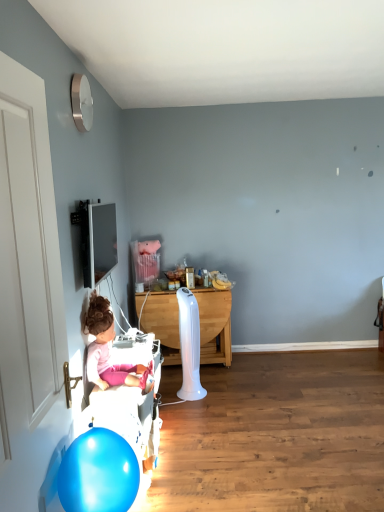
Question: Would you say pink fabric doll at lower left is outside blue glossy balloon at lower left?

Choices:
 (A) no
 (B) yes

Answer: (B)

Question: Can you confirm if pink fabric doll at lower left is thinner than blue glossy balloon at lower left?

Choices:
 (A) no
 (B) yes

Answer: (A)

Question: Does pink fabric doll at lower left have a greater height compared to blue glossy balloon at lower left?

Choices:
 (A) no
 (B) yes

Answer: (B)

Question: Considering the relative sizes of pink fabric doll at lower left and blue glossy balloon at lower left in the image provided, is pink fabric doll at lower left smaller than blue glossy balloon at lower left?

Choices:
 (A) no
 (B) yes

Answer: (A)

Question: From the image's perspective, is pink fabric doll at lower left on top of blue glossy balloon at lower left?

Choices:
 (A) no
 (B) yes

Answer: (B)

Question: Visually, is white wood table at center positioned to the left or to the right of blue glossy balloon at lower left?

Choices:
 (A) left
 (B) right

Answer: (B)

Question: Relative to blue glossy balloon at lower left, is white wood table at center in front or behind?

Choices:
 (A) behind
 (B) front

Answer: (A)

Question: Is white wood table at center taller or shorter than blue glossy balloon at lower left?

Choices:
 (A) tall
 (B) short

Answer: (A)

Question: From the image's perspective, relative to blue glossy balloon at lower left, is white wood table at center above or below?

Choices:
 (A) above
 (B) below

Answer: (A)

Question: Does point (172, 311) appear closer or farther from the camera than point (91, 304)?

Choices:
 (A) farther
 (B) closer

Answer: (A)

Question: In the image, is white wood table at center positioned in front of or behind pink fabric doll at lower left?

Choices:
 (A) front
 (B) behind

Answer: (B)

Question: Would you say white wood table at center is to the left or to the right of pink fabric doll at lower left in the picture?

Choices:
 (A) right
 (B) left

Answer: (A)

Question: Considering the positions of white wood table at center and pink fabric doll at lower left in the image, is white wood table at center wider or thinner than pink fabric doll at lower left?

Choices:
 (A) wide
 (B) thin

Answer: (A)

Question: Is point (79, 446) closer or farther from the camera than point (96, 302)?

Choices:
 (A) closer
 (B) farther

Answer: (A)

Question: Choose the correct answer: Is blue glossy balloon at lower left inside pink fabric doll at lower left or outside it?

Choices:
 (A) outside
 (B) inside

Answer: (A)